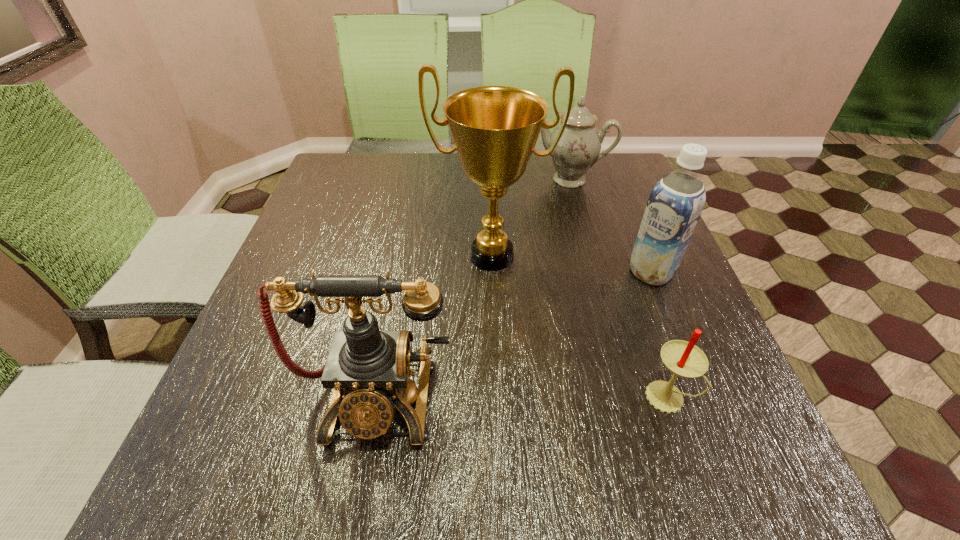
At what (x,y) coordinates should I click in order to perform the action: click on free space at the far left corner. Please return your answer as a coordinate pair (x, y). Looking at the image, I should click on (347, 164).

The width and height of the screenshot is (960, 540). In the image, there is a desktop. Find the location of `vacant region at the near left corner`. vacant region at the near left corner is located at coordinates (228, 433).

In the image, there is a desktop. Find the location of `vacant space at the far right corner`. vacant space at the far right corner is located at coordinates (598, 170).

This screenshot has width=960, height=540. Identify the location of free space between the shortest object and the chinaware. (618, 288).

Locate an element on the screen. free spot between the fourth tallest object and the award is located at coordinates (530, 218).

At what (x,y) coordinates should I click in order to perform the action: click on free spot between the soya milk and the tallest object. Please return your answer as a coordinate pair (x, y). This screenshot has height=540, width=960. Looking at the image, I should click on (571, 264).

At what (x,y) coordinates should I click in order to perform the action: click on free point between the farthest object and the soya milk. Please return your answer as a coordinate pair (x, y). This screenshot has height=540, width=960. Looking at the image, I should click on (610, 226).

You are a GUI agent. You are given a task and a screenshot of the screen. Output one action in this format:
    pyautogui.click(x=<x>, y=<y>)
    Task: Click on the blank region between the soya milk and the shortest object
    This screenshot has width=960, height=540.
    Given the screenshot: What is the action you would take?
    (660, 334)

Locate an element on the screen. This screenshot has width=960, height=540. vacant space in between the shortest object and the soya milk is located at coordinates (660, 334).

This screenshot has width=960, height=540. What are the coordinates of `free space between the shortest object and the award` in the screenshot? It's located at (580, 326).